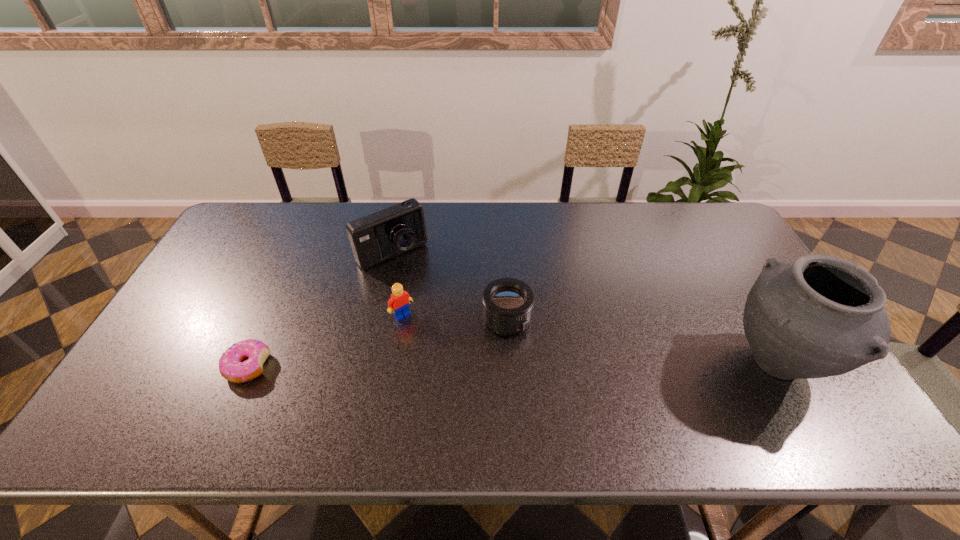
Identify the location of free space at the far right corner of the desktop. The height and width of the screenshot is (540, 960). (689, 242).

This screenshot has height=540, width=960. I want to click on free area in between the urn and the telephoto lens, so click(x=642, y=341).

The height and width of the screenshot is (540, 960). Identify the location of free spot between the Lego and the second shortest object. (455, 317).

Locate an element on the screen. The image size is (960, 540). empty space between the leftmost object and the rightmost object is located at coordinates (512, 365).

The height and width of the screenshot is (540, 960). In order to click on vacant region between the fourth tallest object and the leftmost object in this screenshot , I will do `click(377, 342)`.

Locate an element on the screen. blank region between the leftmost object and the farthest object is located at coordinates (320, 309).

Find the location of `empty space that is in between the rightmost object and the second tallest object`. empty space that is in between the rightmost object and the second tallest object is located at coordinates (585, 308).

Identify the location of vacant area that lies between the doughnut and the tallest object. The width and height of the screenshot is (960, 540). (512, 365).

What are the coordinates of `empty space between the rightmost object and the second shortest object` in the screenshot? It's located at (642, 341).

Image resolution: width=960 pixels, height=540 pixels. What are the coordinates of `vacant area between the third shortest object and the doughnut` in the screenshot? It's located at (324, 341).